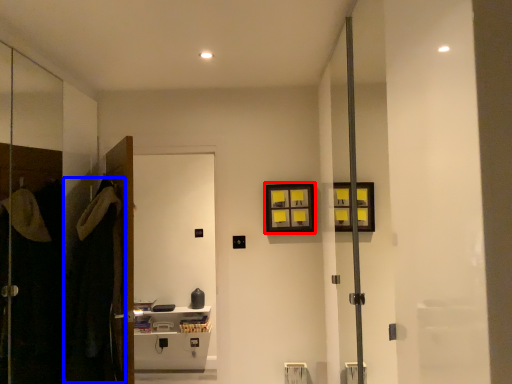
Question: Which object is closer to the camera taking this photo, picture frame (highlighted by a red box) or robe (highlighted by a blue box)?

Choices:
 (A) picture frame
 (B) robe

Answer: (B)